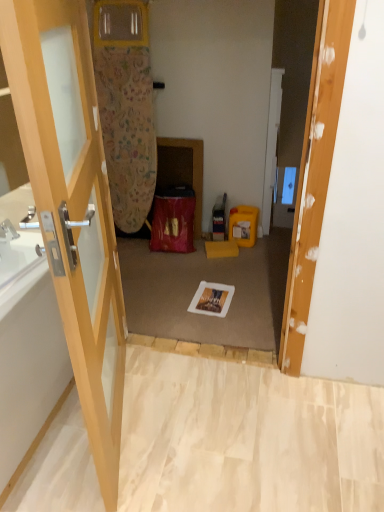
Question: Is wooden door at center, the second door from the back, spatially inside yellow plastic box at center-right, or outside of it?

Choices:
 (A) inside
 (B) outside

Answer: (B)

Question: In the image, is wooden door at center, the second door from the back, on the left side or the right side of yellow plastic box at center-right?

Choices:
 (A) right
 (B) left

Answer: (B)

Question: Estimate the real-world distances between objects in this image. Which object is farther from the white glossy door at center, which is the 1th door from right to left?

Choices:
 (A) yellow plastic box at center-right
 (B) wooden door at center, which ranks as the second door in right-to-left order
 (C) white glossy bathtub at left

Answer: (C)

Question: Estimate the real-world distances between objects in this image. Which object is farther from the yellow plastic box at center-right?

Choices:
 (A) wooden door at center, which ranks as the 1th door in left-to-right order
 (B) white glossy door at center, the second door in the left-to-right sequence
 (C) white glossy bathtub at left

Answer: (C)